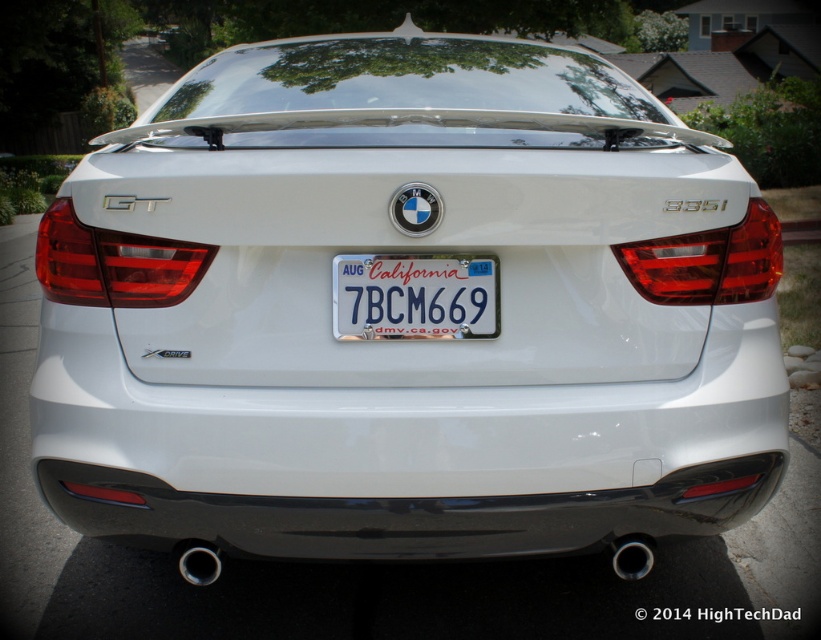
Question: Considering the relative positions of matte plastic tail light at center-left and matte red tail light at right in the image provided, where is matte plastic tail light at center-left located with respect to matte red tail light at right?

Choices:
 (A) above
 (B) below

Answer: (A)

Question: Among these objects, which one is nearest to the camera?

Choices:
 (A) matte red tail light at right
 (B) white metallic license plate at center

Answer: (B)

Question: In this image, where is matte plastic tail light at center-left located relative to matte red tail light at right?

Choices:
 (A) below
 (B) above

Answer: (B)

Question: Which point is farther to the camera?

Choices:
 (A) (104, 232)
 (B) (705, 275)

Answer: (B)

Question: Which point is farther to the camera?

Choices:
 (A) matte plastic tail light at center-left
 (B) matte red tail light at right

Answer: (B)

Question: Is white metallic license plate at center above matte red tail light at right?

Choices:
 (A) yes
 (B) no

Answer: (B)